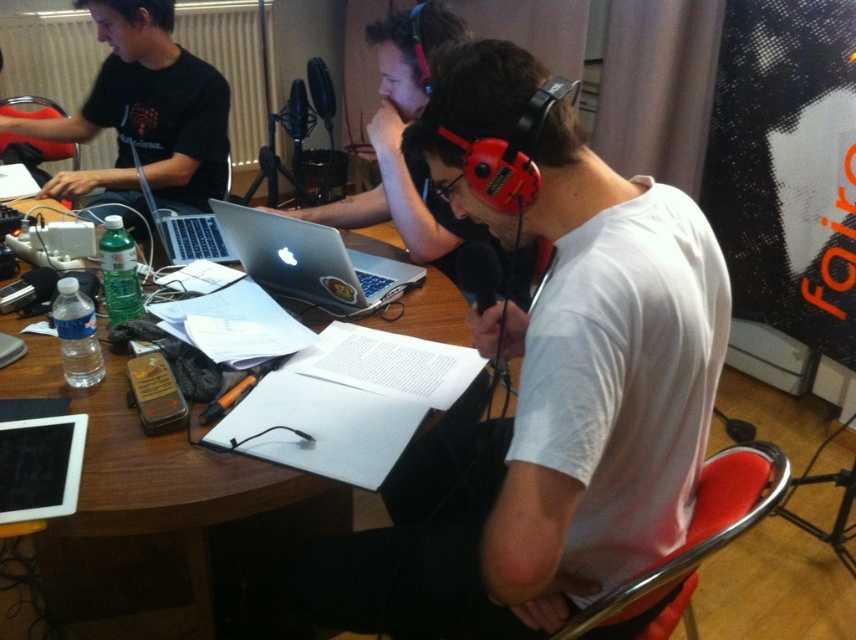
Can you confirm if white cotton shirt at center is shorter than wooden at center?

No.

Who is more forward, (382, 605) or (272, 552)?

Point (382, 605) is in front.

Describe the element at coordinates (545, 392) in the screenshot. I see `white cotton shirt at center` at that location.

Find the location of a particular element. The height and width of the screenshot is (640, 856). white cotton shirt at center is located at coordinates (545, 392).

Which is more to the left, silver metallic laptop at center or silver metallic laptop at upper left?

Positioned to the left is silver metallic laptop at upper left.

Is silver metallic laptop at center above silver metallic laptop at upper left?

Actually, silver metallic laptop at center is below silver metallic laptop at upper left.

Is point (378, 296) farther from camera compared to point (131, 147)?

No, (378, 296) is closer to viewer.

Where is `silver metallic laptop at center`? The height and width of the screenshot is (640, 856). silver metallic laptop at center is located at coordinates (311, 260).

Who is positioned more to the left, white cotton shirt at center or matte black shirt at left?

From the viewer's perspective, matte black shirt at left appears more on the left side.

Can you confirm if white cotton shirt at center is bigger than matte black shirt at left?

No.

Between point (693, 252) and point (201, 168), which one is positioned in front?

Point (693, 252) is more forward.

The height and width of the screenshot is (640, 856). In order to click on white cotton shirt at center in this screenshot , I will do `click(545, 392)`.